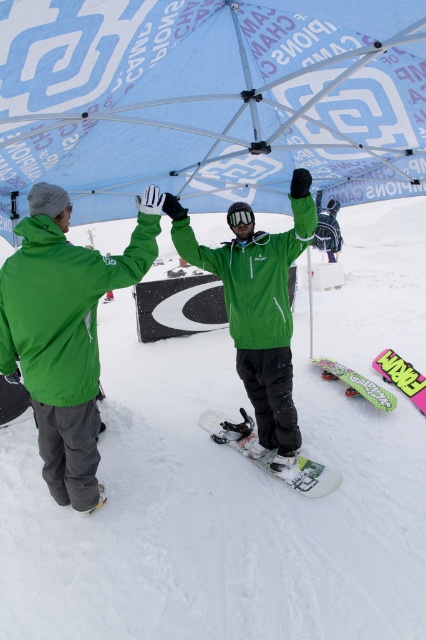
Question: Does green matte jacket at center have a larger size compared to neon green plastic snowboard at lower right?

Choices:
 (A) yes
 (B) no

Answer: (A)

Question: Can you confirm if white matte snowboard at center is positioned above white glossy snowboard at center?

Choices:
 (A) no
 (B) yes

Answer: (B)

Question: Among these objects, which one is farthest from the camera?

Choices:
 (A) pink matte snowboard at lower right
 (B) blue printed canopy at upper center
 (C) white matte snowboard at center

Answer: (A)

Question: Which object is farther from the camera taking this photo?

Choices:
 (A) white matte snowboard at center
 (B) green matte jacket at center
 (C) pink matte snowboard at lower right

Answer: (C)

Question: Which of the following is the farthest from the observer?

Choices:
 (A) pink matte snowboard at lower right
 (B) green matte jacket at center

Answer: (A)

Question: Can you confirm if white glossy snowboard at center is bigger than pink matte snowboard at lower right?

Choices:
 (A) no
 (B) yes

Answer: (B)